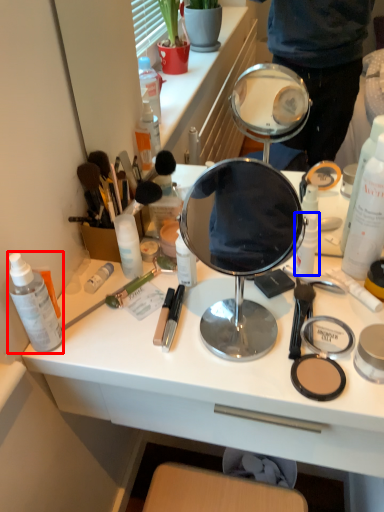
Question: Which point is closer to the camera, toiletry (highlighted by a red box) or toiletry (highlighted by a blue box)?

Choices:
 (A) toiletry
 (B) toiletry

Answer: (A)